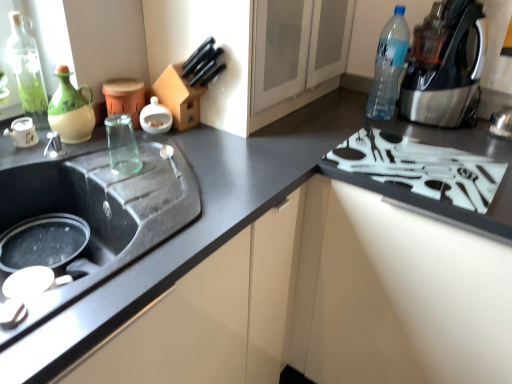
The height and width of the screenshot is (384, 512). Find the location of `vacant space situated on the left part of white plastic gas stove at right`. vacant space situated on the left part of white plastic gas stove at right is located at coordinates (297, 139).